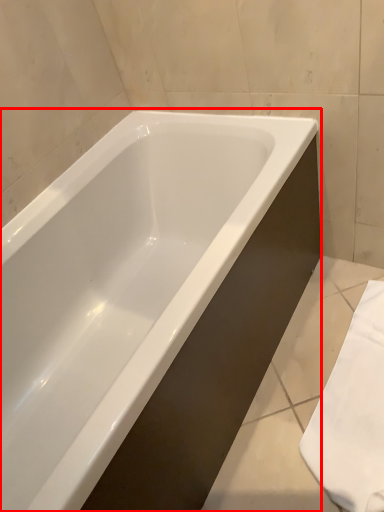
Question: From the image, what is the correct spatial relationship of bathtub (annotated by the red box) in relation to bath towel?

Choices:
 (A) left
 (B) right

Answer: (A)